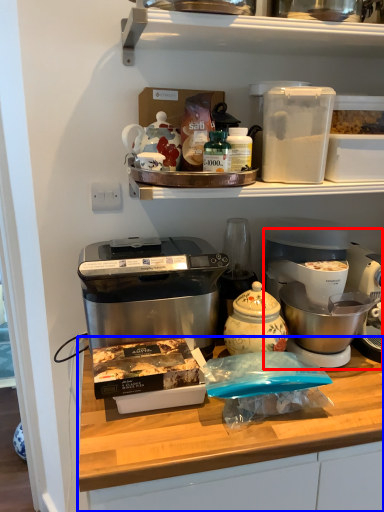
Question: Which object appears farthest to the camera in this image, coffee maker (highlighted by a red box) or table (highlighted by a blue box)?

Choices:
 (A) coffee maker
 (B) table

Answer: (A)